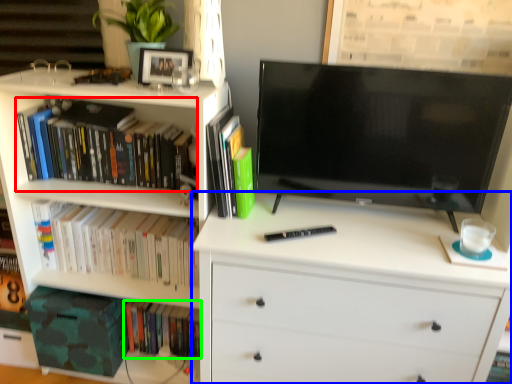
Question: Considering the real-world distances, which object is farthest from book (highlighted by a red box)? chest of drawers (highlighted by a blue box) or book (highlighted by a green box)?

Choices:
 (A) chest of drawers
 (B) book

Answer: (B)